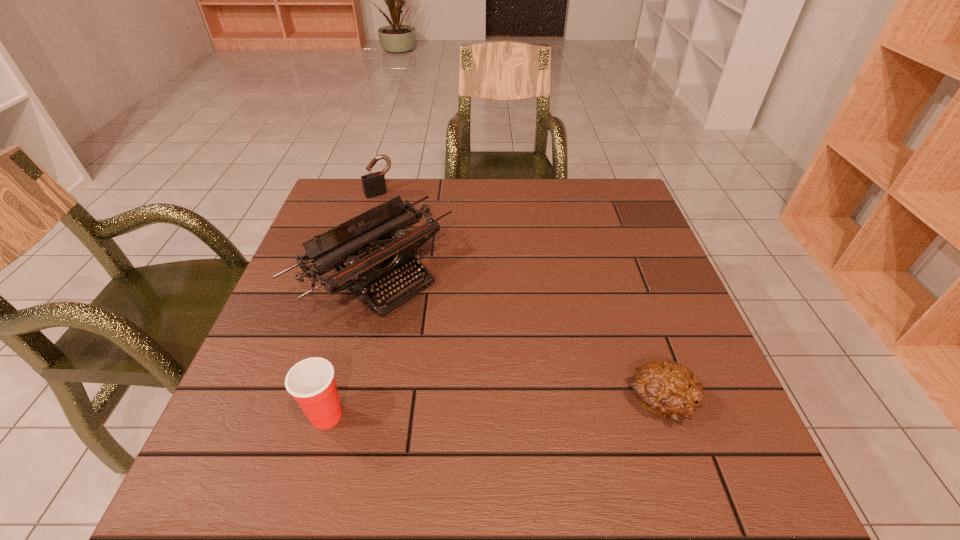
Find the location of a particular element. object that is at the right edge is located at coordinates (665, 388).

The image size is (960, 540). I want to click on object present at the far left corner, so click(374, 184).

Find the location of `object that is at the near left corner`. object that is at the near left corner is located at coordinates (311, 382).

Locate an element on the screen. object positioned at the near right corner is located at coordinates (665, 388).

This screenshot has width=960, height=540. Identify the location of vacant space at the far edge. (530, 180).

What are the coordinates of `blank space at the near edge` in the screenshot? It's located at (457, 430).

Where is `free point at the left edge`? This screenshot has height=540, width=960. free point at the left edge is located at coordinates (334, 305).

The height and width of the screenshot is (540, 960). In the image, there is a desktop. Identify the location of vacant space at the right edge. (668, 315).

The height and width of the screenshot is (540, 960). In order to click on vacant region at the far left corner in this screenshot , I will do (367, 201).

Where is `free region at the near left corner of the desktop`? Image resolution: width=960 pixels, height=540 pixels. free region at the near left corner of the desktop is located at coordinates (229, 406).